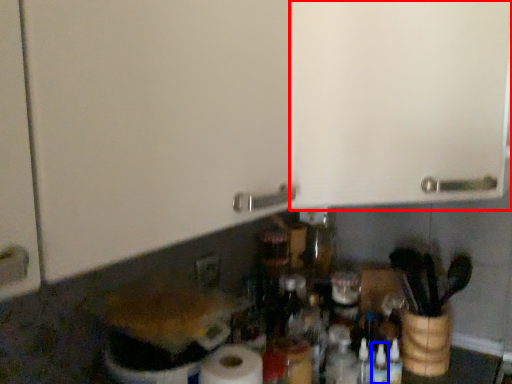
Question: Which point is further to the camera, cabinetry (highlighted by a red box) or bottle (highlighted by a blue box)?

Choices:
 (A) cabinetry
 (B) bottle

Answer: (B)